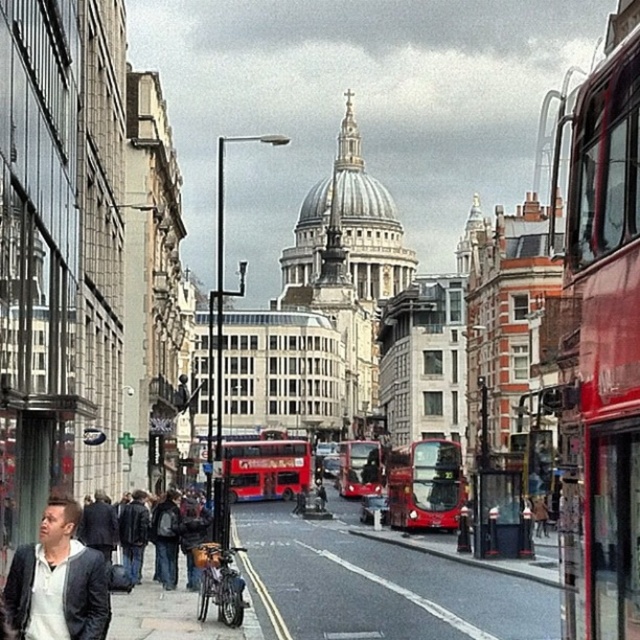
Between point (330, 502) and point (244, 499), which one is positioned behind?

Point (330, 502)

Image resolution: width=640 pixels, height=640 pixels. Describe the element at coordinates (384, 586) in the screenshot. I see `smooth asphalt road at center` at that location.

Where is `smooth asphalt road at center`? The width and height of the screenshot is (640, 640). smooth asphalt road at center is located at coordinates (384, 586).

Can you confirm if smooth asphalt road at center is shorter than matte black jacket at lower left?

In fact, smooth asphalt road at center may be taller than matte black jacket at lower left.

Can you confirm if smooth asphalt road at center is wider than matte black jacket at lower left?

Indeed, smooth asphalt road at center has a greater width compared to matte black jacket at lower left.

Which is in front, point (250, 520) or point (49, 509)?

Point (49, 509)

Where is `smooth asphalt road at center`? The image size is (640, 640). smooth asphalt road at center is located at coordinates (384, 586).

Is matte black jacket at lower left behind dark blue suit at lower left?

No, matte black jacket at lower left is closer to the viewer.

Can you confirm if matte black jacket at lower left is wider than dark blue suit at lower left?

Incorrect, matte black jacket at lower left's width does not surpass dark blue suit at lower left's.

Is point (74, 621) positioned after point (99, 506)?

No, it is in front of (99, 506).

You are a GUI agent. You are given a task and a screenshot of the screen. Output one action in this format:
    pyautogui.click(x=<x>, y=<y>)
    Task: Click on the matte black jacket at lower left
    This screenshot has height=640, width=640.
    Given the screenshot: What is the action you would take?
    pyautogui.click(x=58, y=580)